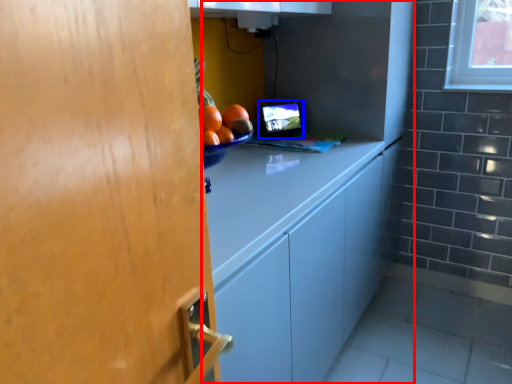
Question: Which object appears farthest to the camera in this image, cabinetry (highlighted by a red box) or computer monitor (highlighted by a blue box)?

Choices:
 (A) cabinetry
 (B) computer monitor

Answer: (B)